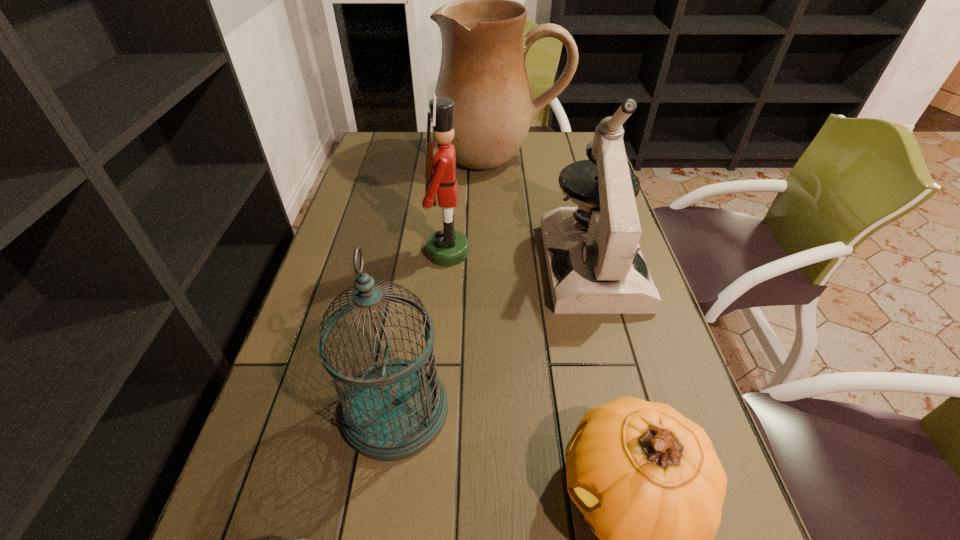
Where is `cream pitcher`? Image resolution: width=960 pixels, height=540 pixels. cream pitcher is located at coordinates (482, 70).

Identify the location of nutcracker. (448, 247).

Locate an element on the screen. Image resolution: width=960 pixels, height=540 pixels. microscope is located at coordinates (602, 271).

The width and height of the screenshot is (960, 540). Find the location of `birdcage`. birdcage is located at coordinates (393, 410).

Locate an element on the screen. The height and width of the screenshot is (540, 960). vacant region located 0.330m at the spout of the cream pitcher is located at coordinates (505, 251).

The width and height of the screenshot is (960, 540). Identify the location of free space located on the front-facing side of the nutcracker. (596, 252).

I want to click on free space located 0.130m at the eyepiece of the microscope, so click(618, 362).

Find the location of a particular element. This screenshot has height=540, width=960. vacant area situated on the front-facing side of the birdcage is located at coordinates (501, 410).

Identify the location of object located at the far edge. (482, 70).

Where is `object that is at the left edge`? This screenshot has width=960, height=540. object that is at the left edge is located at coordinates (393, 410).